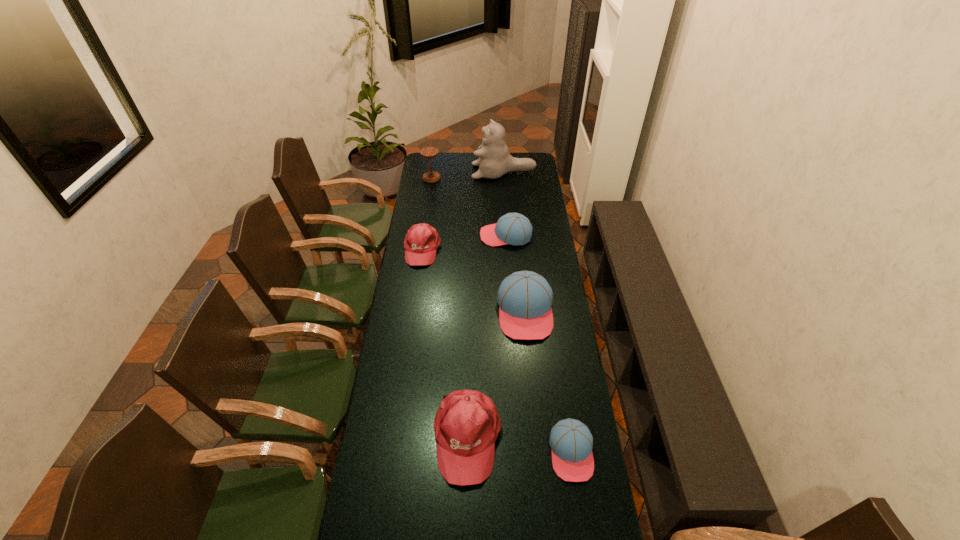
The height and width of the screenshot is (540, 960). I want to click on vacant space located 0.270m on the front-facing side of the farthest blue baseball cap, so click(x=427, y=235).

This screenshot has height=540, width=960. Find the location of `vacant space located 0.170m at the front of the farther red baseball cap with the brim`. vacant space located 0.170m at the front of the farther red baseball cap with the brim is located at coordinates (416, 295).

Find the location of `cat situated at the far edge`. cat situated at the far edge is located at coordinates (494, 161).

Identify the location of hourglass located at the far edge. The height and width of the screenshot is (540, 960). (428, 153).

Image resolution: width=960 pixels, height=540 pixels. I want to click on hourglass at the left edge, so click(428, 153).

In order to click on baseball cap present at the left edge in this screenshot , I will do `click(422, 240)`.

Identify the location of cat situated at the right edge. (494, 161).

I want to click on object located at the far left corner, so click(x=428, y=153).

Where is `object at the far right corner`? The image size is (960, 540). object at the far right corner is located at coordinates (494, 161).

Where is `vacant space at the far edge of the desktop`? vacant space at the far edge of the desktop is located at coordinates (449, 170).